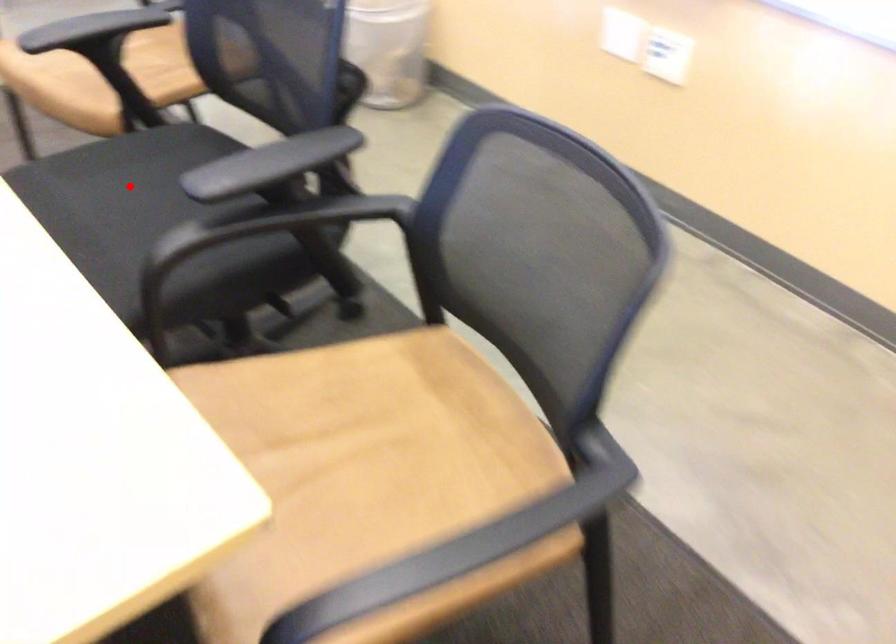
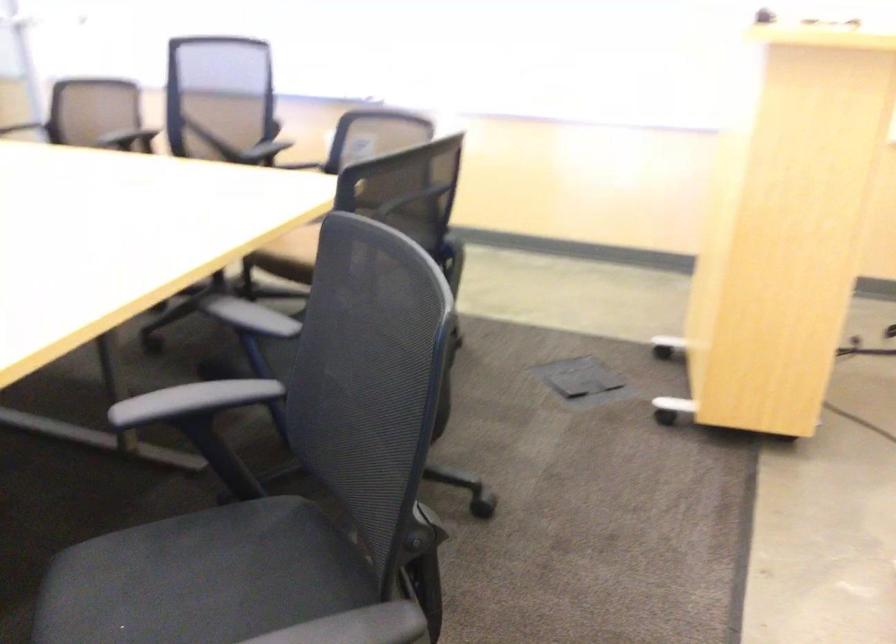
Question: I am providing you with two images of the same scene from different viewpoints. A red point is marked on the first image. Is the red point's position out of view in image 2?

Choices:
 (A) Yes
 (B) No

Answer: (A)